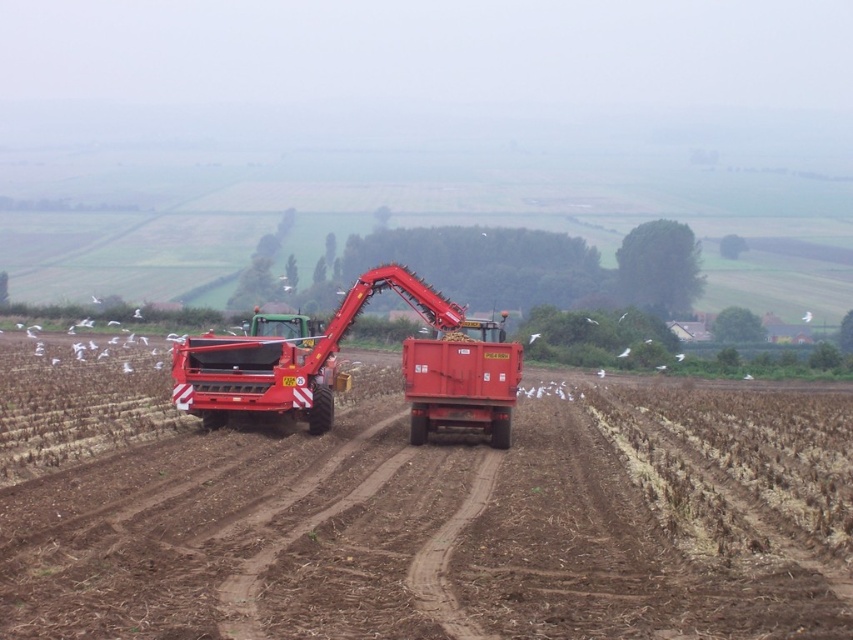
Question: Estimate the real-world distances between objects in this image. Which object is farther from the matte red trailer truck at center?

Choices:
 (A) dirt field at center
 (B) white feathered bird at center

Answer: (B)

Question: Among these points, which one is farthest from the camera?

Choices:
 (A) (618, 355)
 (B) (306, 372)
 (C) (343, 512)

Answer: (A)

Question: Where is dirt field at center located in relation to white feathered bird at center in the image?

Choices:
 (A) below
 (B) above

Answer: (A)

Question: Does dirt field at center appear over matte red trailer truck at center?

Choices:
 (A) yes
 (B) no

Answer: (B)

Question: Which point is farther to the camera?

Choices:
 (A) white feathered bird at center
 (B) dirt field at center

Answer: (A)

Question: Can you confirm if dirt field at center is positioned to the left of matte red trailer truck at center?

Choices:
 (A) yes
 (B) no

Answer: (B)